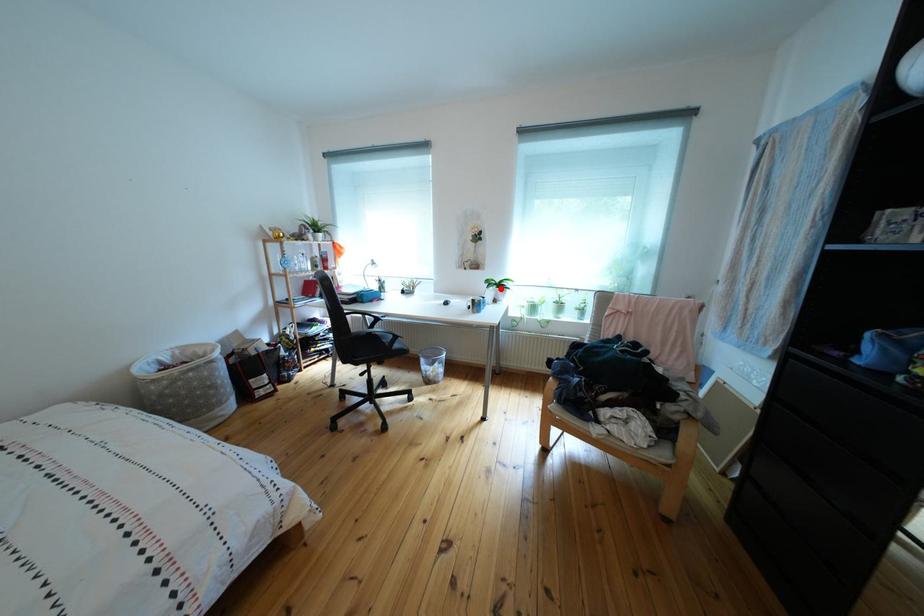
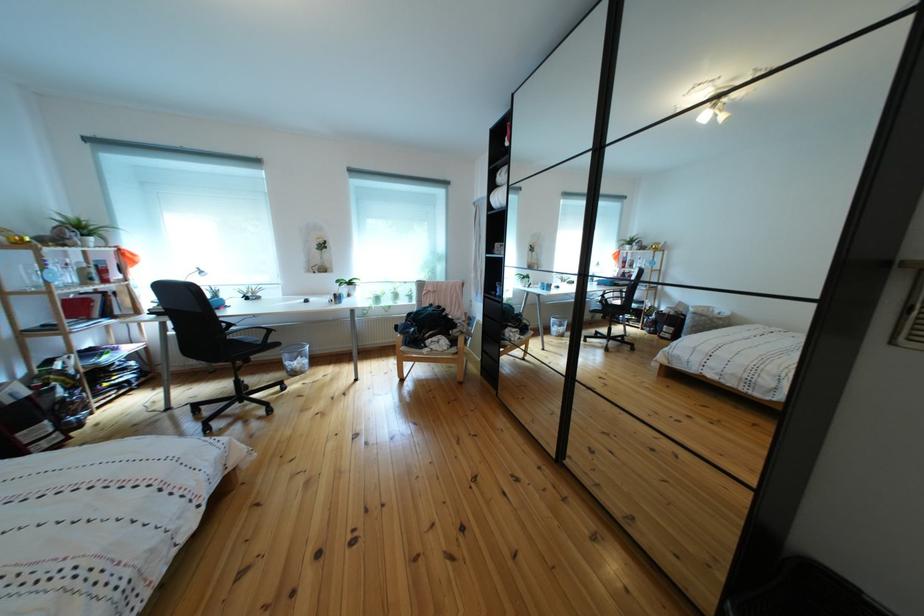
Question: I am providing you with two images of the same scene from different viewpoints. In image1, a red point is highlighted. Considering the same 3D point in image2, which of the following is correct?

Choices:
 (A) It is closer
 (B) It is farther

Answer: (A)